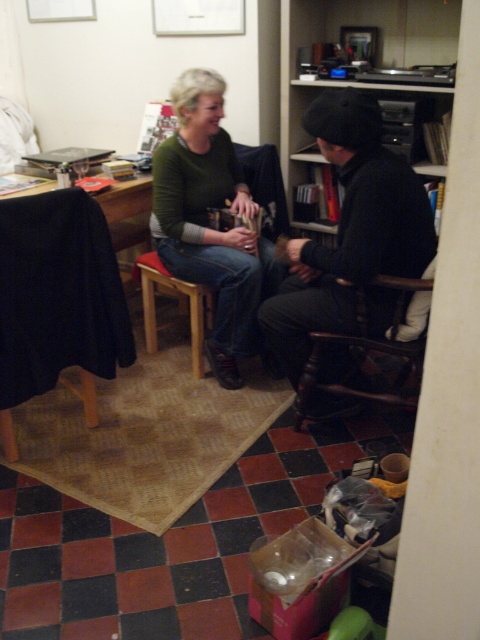
You are organizing a charity clothing drive and need to determine which items are hats and which are sweaters. Looking at the dark woolen hat at center and the matte green sweater at center, which one is bigger?

The dark woolen hat at center is larger in size than the matte green sweater at center.

You are standing in the living room and notice the matte green sweater at center and the wooden bookshelf at upper center. Which object is positioned higher in the image?

The wooden bookshelf at upper center is positioned higher than the matte green sweater at center.

You are standing in the living room and want to reach both the point at coordinates point (243, 348) and the point at coordinates point (291, 90). Which point will you reach first if you move directly towards them?

You will reach point (243, 348) first because it is closer to you than point (291, 90), which is further away.